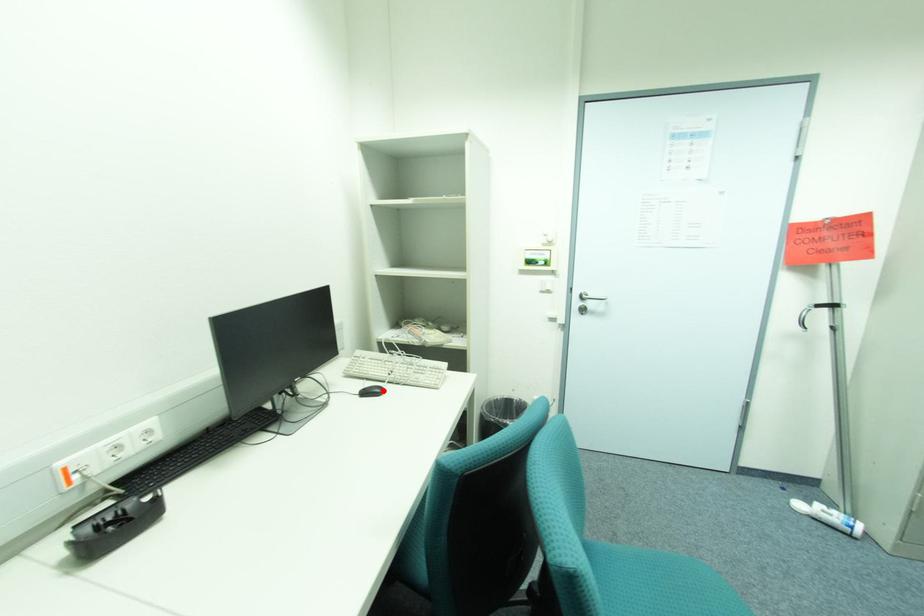
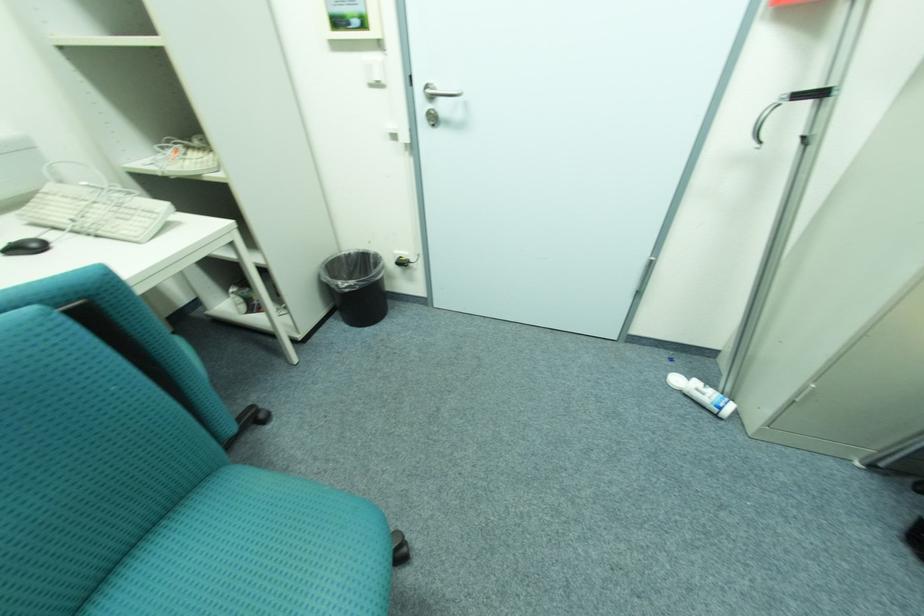
In the second image, find the point that corresponds to the highlighted location in the first image.

(43, 246)